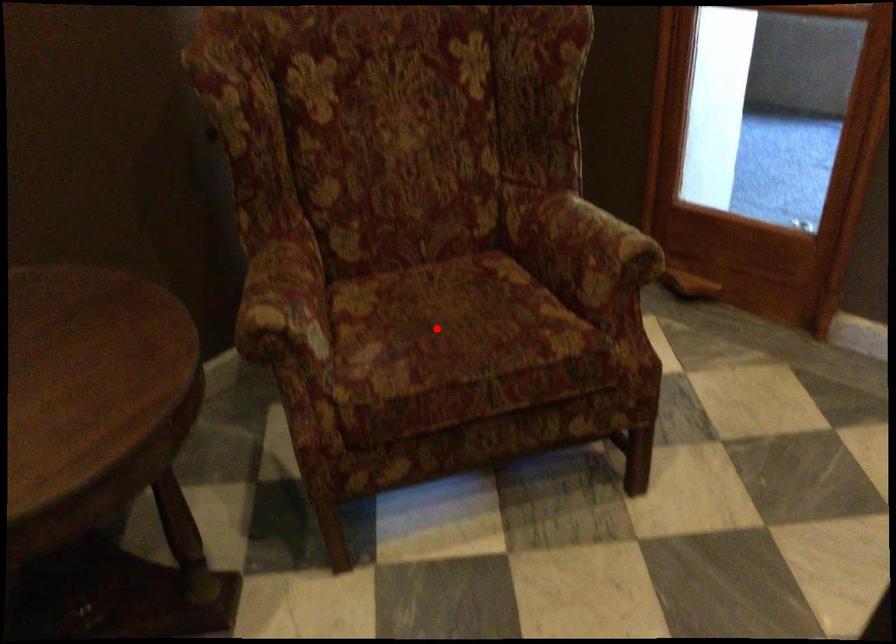
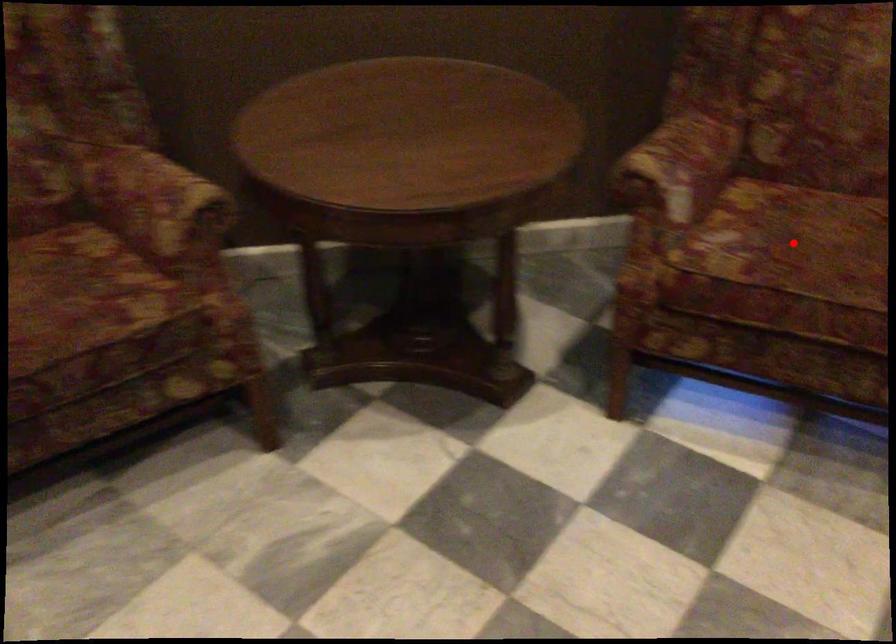
I am providing you with two images of the same scene from different viewpoints. A red point is marked on the first image and another point is marked on the second image. Are the points marked in image1 and image2 representing the same 3D position?

Yes